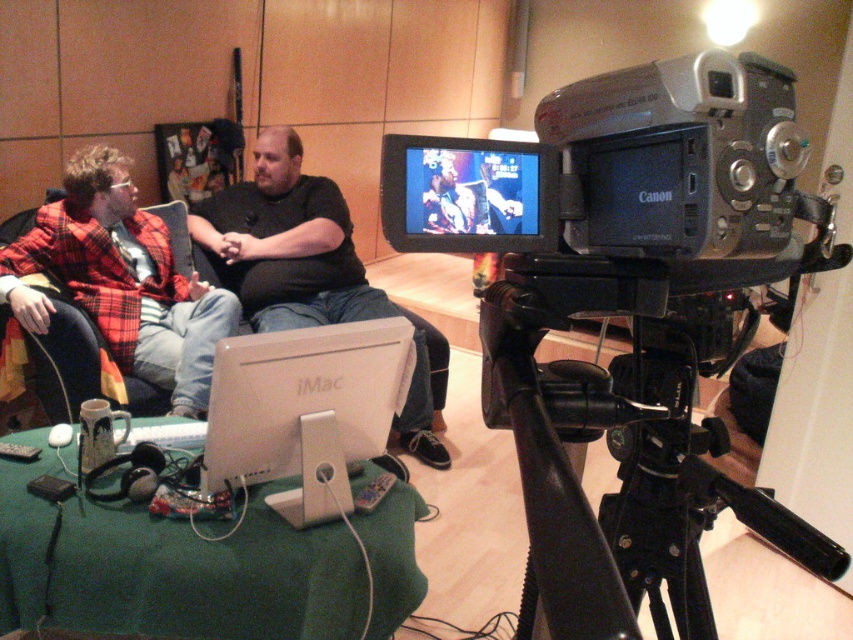
Based on the coordinates provided, can you identify the object located at point (650, 332) in the scene?

The point (650, 332) corresponds to the silver black plastic video camera at center.

From the picture: You are standing in the room where the Canon camcorder is set up. You need to locate the plaid fabric jacket at left. Where would you look relative to the camera?

The plaid fabric jacket at left is located at the coordinates point 0.441 on the x axis and 0.143 on the y axis relative to the camera.